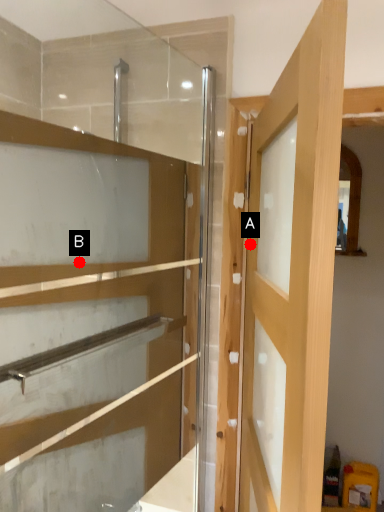
Question: Two points are circled on the image, labeled by A and B beside each circle. Which point is farther from the camera taking this photo?

Choices:
 (A) A is further
 (B) B is further

Answer: (B)